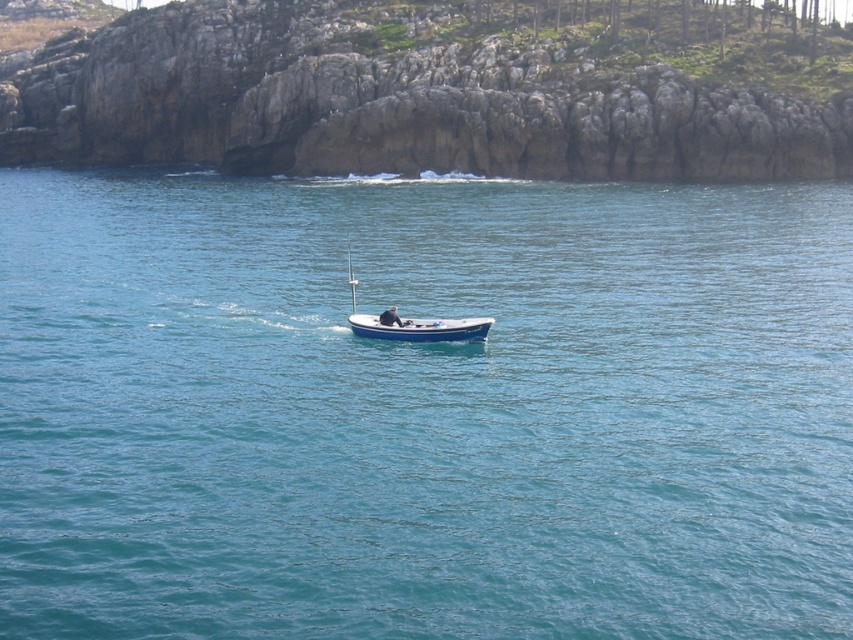
Is blue polished wood boat at center behind light brown leather jacket at center?

No, it is in front of light brown leather jacket at center.

Can you confirm if blue polished wood boat at center is positioned above light brown leather jacket at center?

Indeed, blue polished wood boat at center is positioned over light brown leather jacket at center.

Which is in front, point (373, 337) or point (396, 320)?

Point (396, 320)

Where is `blue polished wood boat at center`? Image resolution: width=853 pixels, height=640 pixels. blue polished wood boat at center is located at coordinates (415, 323).

Is blue water at center bigger than light brown leather jacket at center?

Yes.

Can you confirm if blue water at center is positioned to the left of light brown leather jacket at center?

In fact, blue water at center is to the right of light brown leather jacket at center.

At what (x,y) coordinates should I click in order to perform the action: click on blue water at center. Please return your answer as a coordinate pair (x, y). This screenshot has width=853, height=640. Looking at the image, I should click on (422, 408).

Does blue water at center appear on the right side of blue polished wood boat at center?

Indeed, blue water at center is positioned on the right side of blue polished wood boat at center.

From the picture: Is blue water at center above blue polished wood boat at center?

Yes, blue water at center is above blue polished wood boat at center.

Which is in front, point (445, 422) or point (456, 337)?

Positioned in front is point (445, 422).

Identify the location of blue water at center. This screenshot has width=853, height=640. (422, 408).